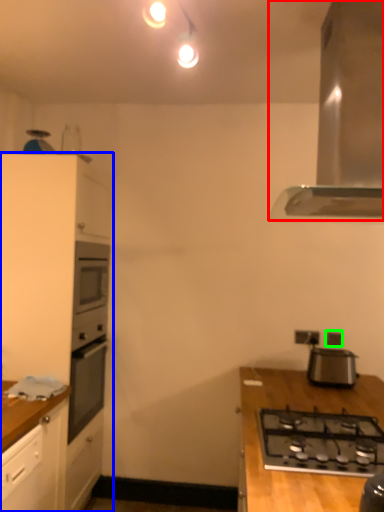
Question: Which object is positioned farthest from home appliance (highlighted by a red box)? Select from cabinetry (highlighted by a blue box) and electric outlet (highlighted by a green box).

Choices:
 (A) cabinetry
 (B) electric outlet

Answer: (A)